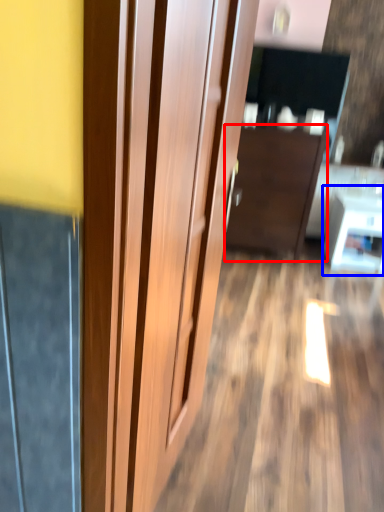
Question: Among these objects, which one is nearest to the camera, furniture (highlighted by a red box) or table (highlighted by a blue box)?

Choices:
 (A) furniture
 (B) table

Answer: (A)